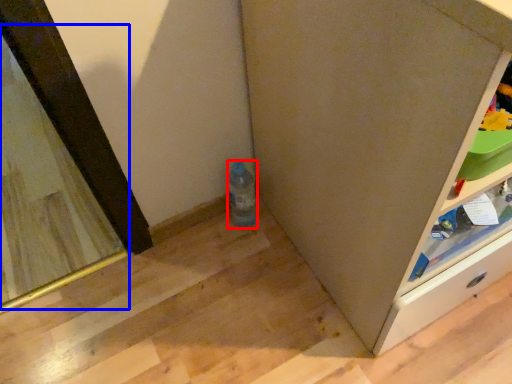
Question: Among these objects, which one is nearest to the camera, bottle (highlighted by a red box) or mirror (highlighted by a blue box)?

Choices:
 (A) bottle
 (B) mirror

Answer: (A)